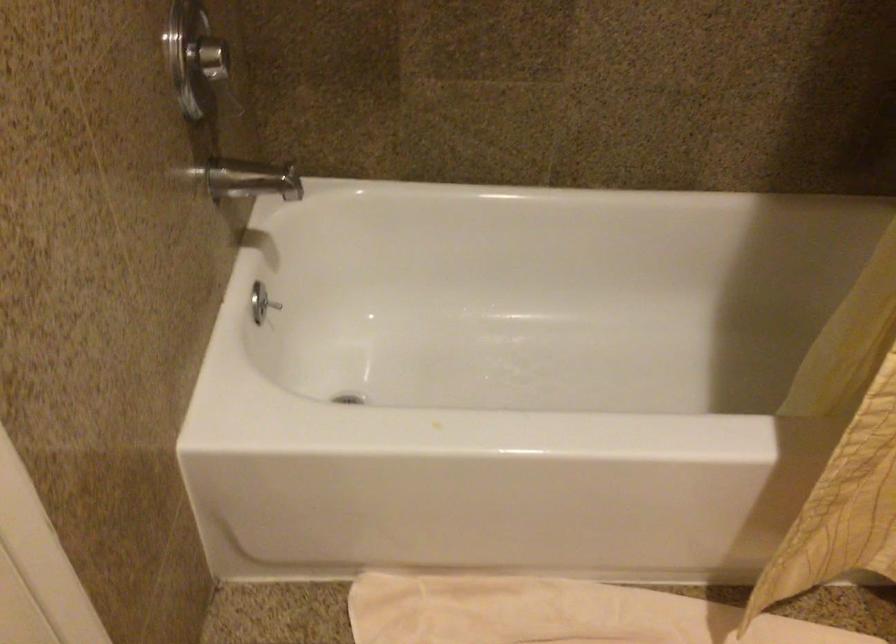
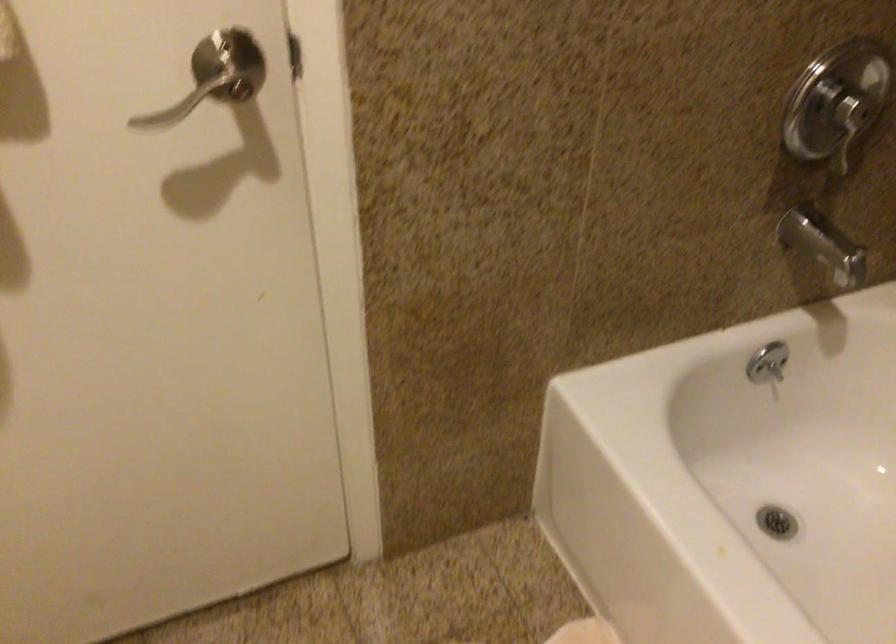
In the second image, find the point that corresponds to [227,79] in the first image.

(849, 127)